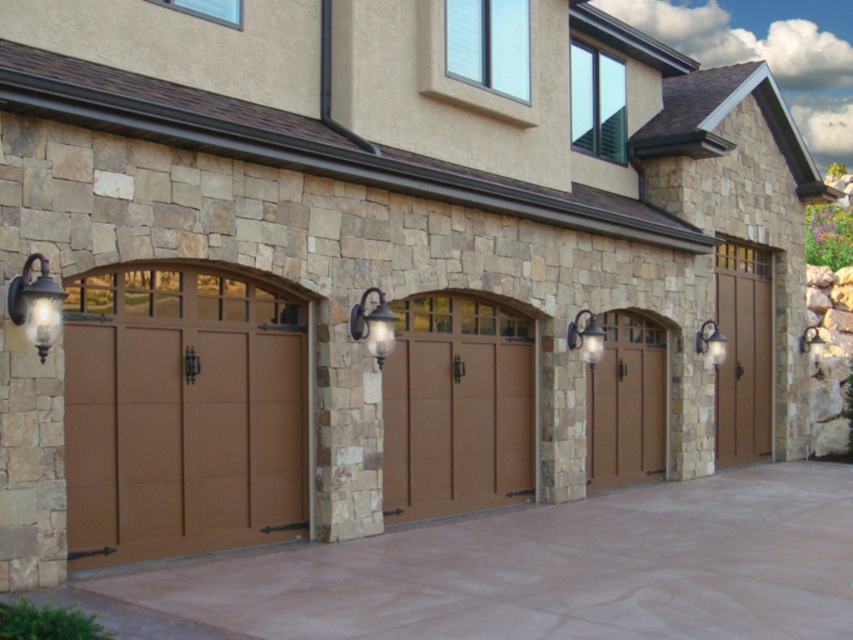
Question: Does brown wood door at right have a lesser width compared to matte brown door at center?

Choices:
 (A) yes
 (B) no

Answer: (B)

Question: Which point is closer to the camera?

Choices:
 (A) brown wood/glass garage door at left
 (B) matte glass sconce at center

Answer: (A)

Question: Which is farther from the brown wood door at center?

Choices:
 (A) brown concrete driveway at center
 (B) brown wood/glass garage door at left

Answer: (B)

Question: Considering the relative positions of brown concrete driveway at center and matte brown door at center in the image provided, where is brown concrete driveway at center located with respect to matte brown door at center?

Choices:
 (A) above
 (B) below

Answer: (B)

Question: Can you confirm if brown wood/glass garage door at left is wider than matte glass sconce at center?

Choices:
 (A) yes
 (B) no

Answer: (A)

Question: Estimate the real-world distances between objects in this image. Which object is closer to the brown wood door at center?

Choices:
 (A) brown concrete driveway at center
 (B) matte black sconce at center
 (C) matte black sconce at upper right
 (D) brown wood/glass garage door at left

Answer: (A)